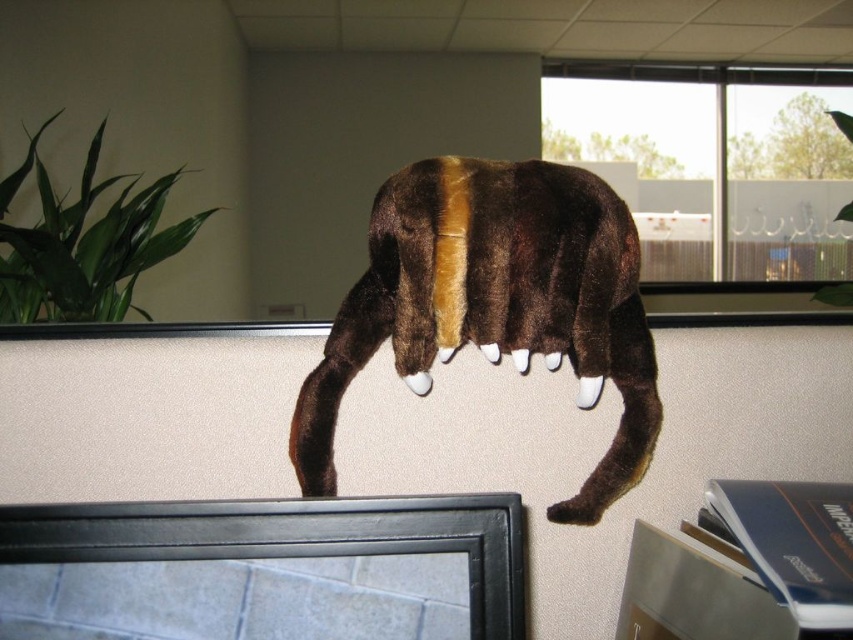
Question: Is brown plush toy at center smaller than brown plush tail at center?

Choices:
 (A) no
 (B) yes

Answer: (A)

Question: Which point is closer to the camera?

Choices:
 (A) brown plush toy at center
 (B) brown plush tail at center

Answer: (A)

Question: Does brown plush toy at center appear over brown plush tail at center?

Choices:
 (A) no
 (B) yes

Answer: (A)

Question: Does brown plush toy at center have a larger size compared to brown plush tail at center?

Choices:
 (A) yes
 (B) no

Answer: (A)